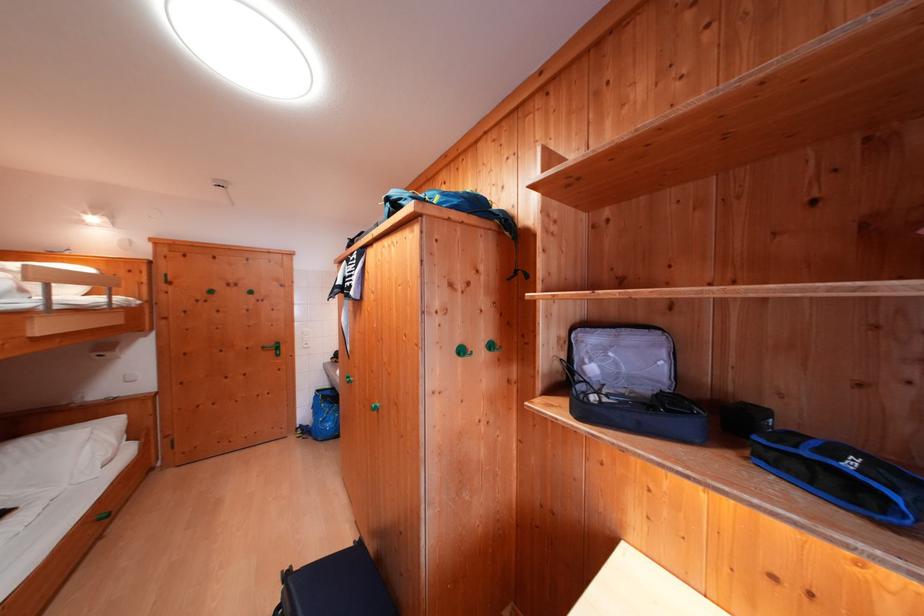
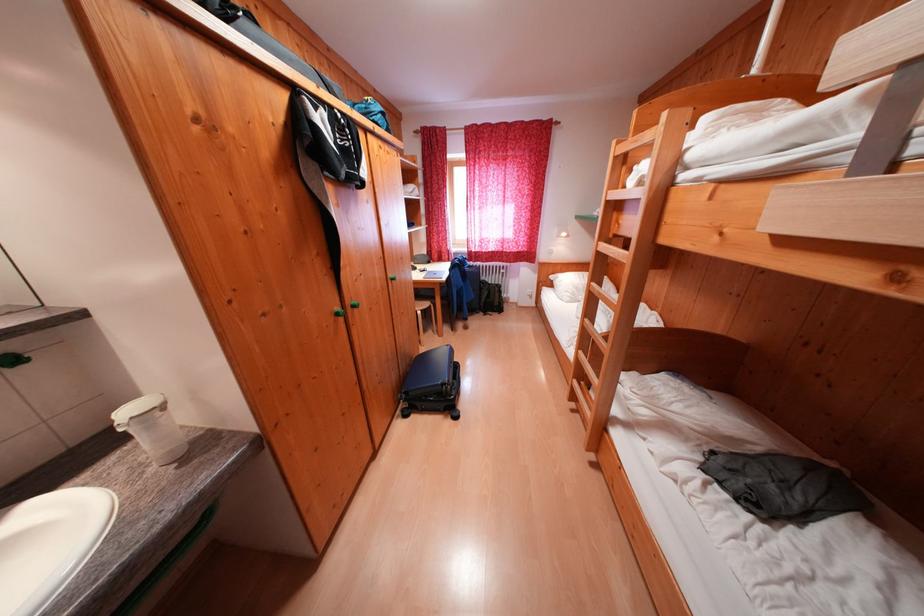
Question: I am providing you with two images of the same scene from different viewpoints. Which of the following objects are not visible in image2?

Choices:
 (A) green cabinet knob
 (B) bunk bed ladder
 (C) blue backpack
 (D) white metal stool

Answer: (A)